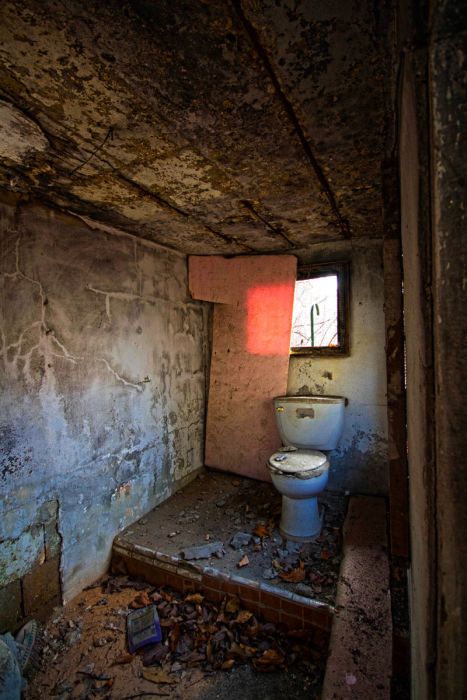
Identify the location of plywood. The width and height of the screenshot is (467, 700). (244, 414).